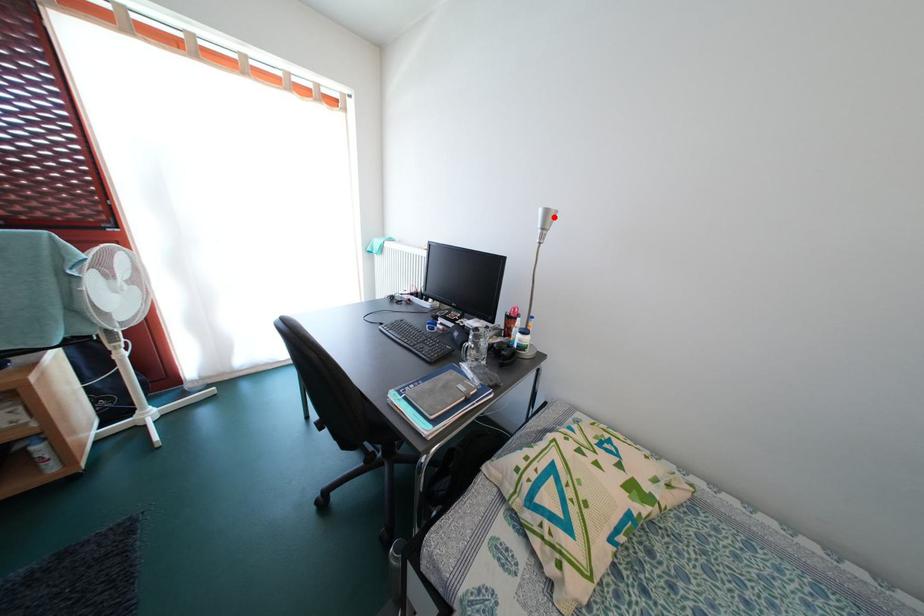
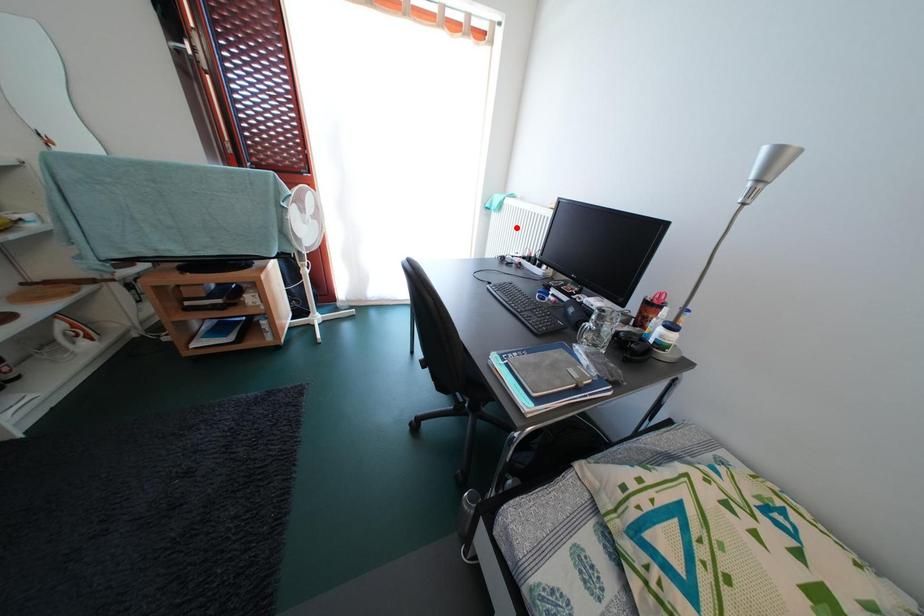
I am providing you with two images of the same scene from different viewpoints. A red point is marked on the first image and another point is marked on the second image. Do the highlighted points in image1 and image2 indicate the same real-world spot?

No